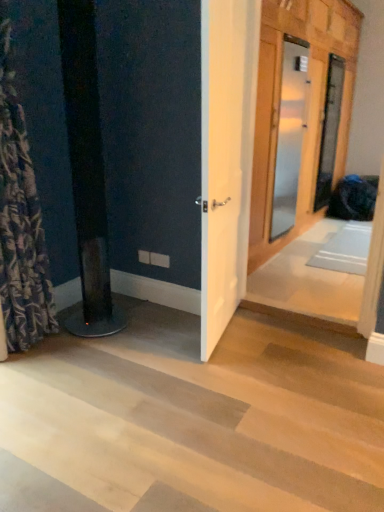
Locate an element on the screen. vacant region in front of patterned fabric shower curtain at left is located at coordinates (28, 383).